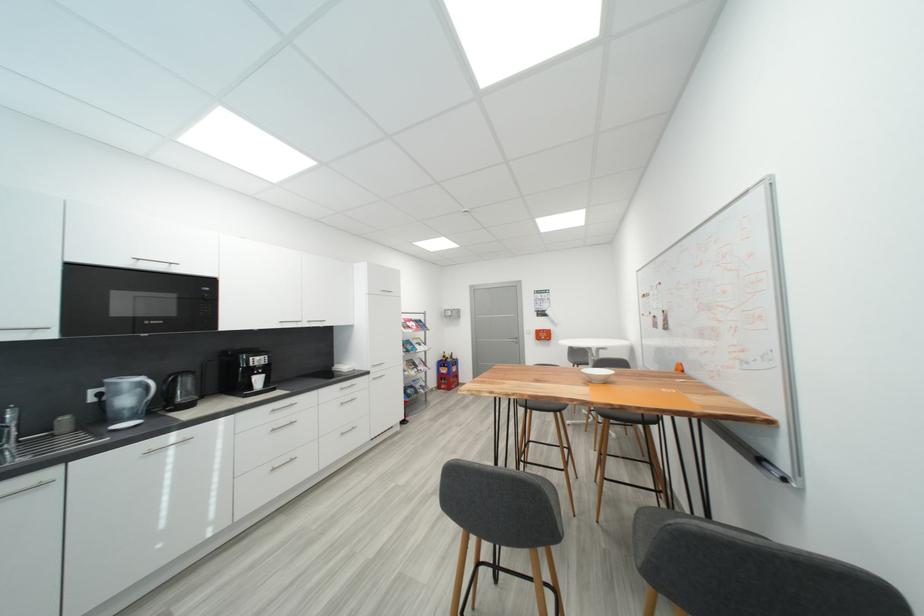
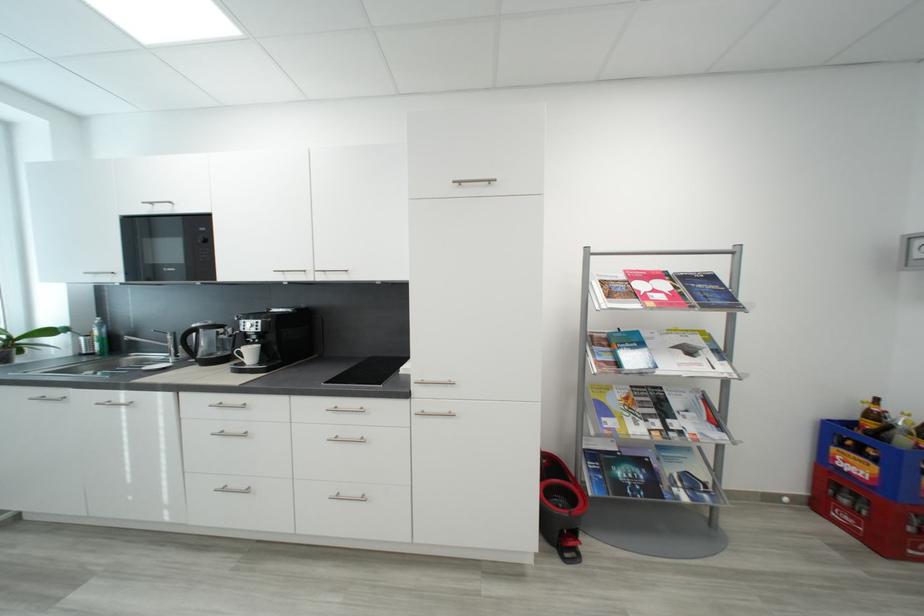
Where in the second image is the point corresponding to point (427, 346) from the first image?

(697, 353)